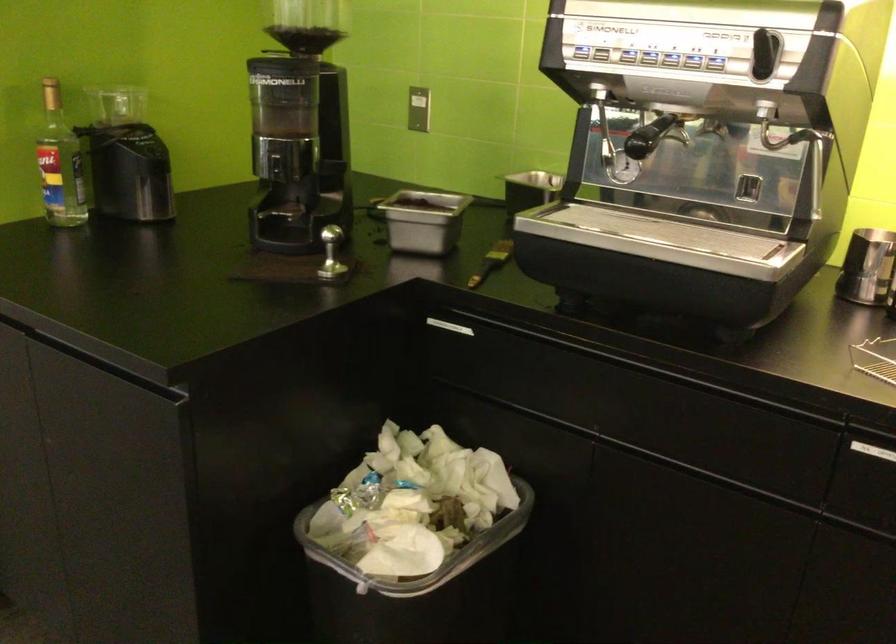
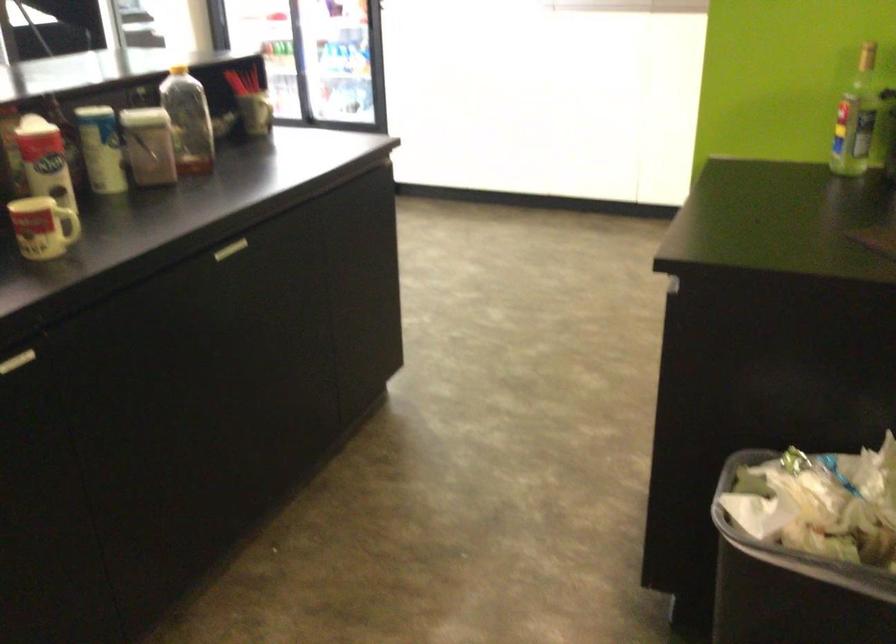
Based on the continuous images, in which direction is the camera rotating?

The camera's rotation is toward left-down.